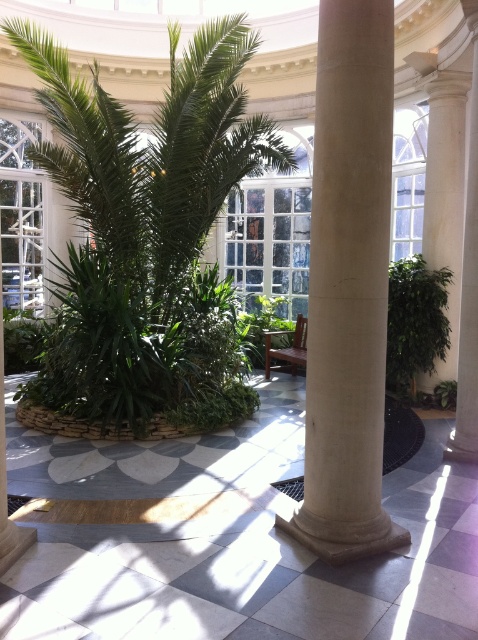
Does green leafy palm tree at center have a greater height compared to green leafy plant at right?

Indeed, green leafy palm tree at center has a greater height compared to green leafy plant at right.

Where is `green leafy palm tree at center`? green leafy palm tree at center is located at coordinates (145, 241).

Does white marble column at center have a larger size compared to green leafy plant at right?

Indeed, white marble column at center has a larger size compared to green leafy plant at right.

Consider the image. Measure the distance between white marble column at center and camera.

A distance of 3.02 meters exists between white marble column at center and camera.

The height and width of the screenshot is (640, 478). Find the location of `white marble column at center`. white marble column at center is located at coordinates (348, 285).

Does point (104, 182) come farther from viewer compared to point (346, 456)?

Yes, it is.

How much distance is there between green leafy palm tree at center and white marble column at center?

They are 3.09 meters apart.

Is point (178, 131) less distant than point (370, 227)?

That is False.

The height and width of the screenshot is (640, 478). What are the coordinates of `green leafy palm tree at center` in the screenshot? It's located at (145, 241).